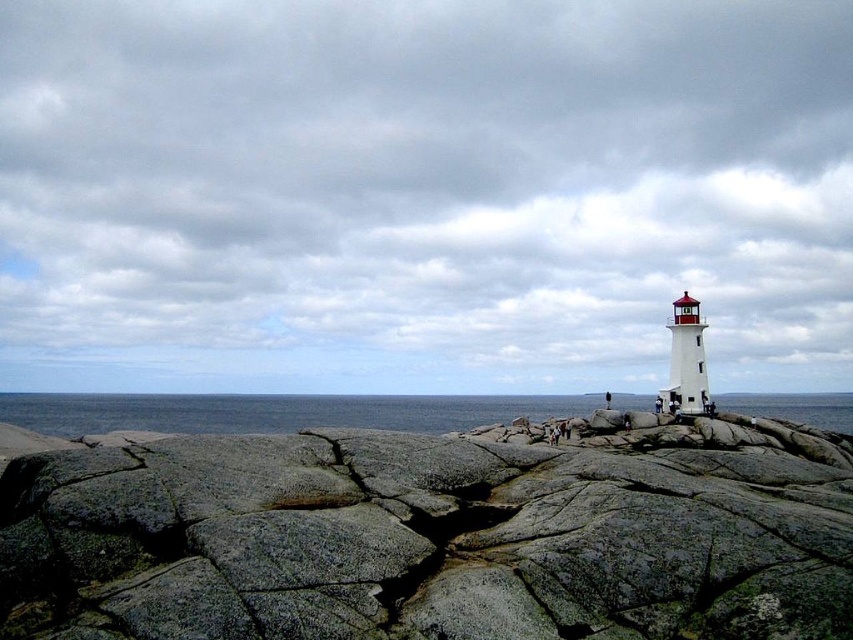
Question: Which object appears closest to the camera in this image?

Choices:
 (A) white painted lighthouse at right
 (B) gray rock at center
 (C) blue water at center

Answer: (B)

Question: Among these objects, which one is farthest from the camera?

Choices:
 (A) blue water at center
 (B) gray rock at center
 (C) white painted lighthouse at right

Answer: (C)

Question: Among these objects, which one is farthest from the camera?

Choices:
 (A) white painted lighthouse at right
 (B) blue water at center

Answer: (A)

Question: Can you confirm if gray rock at center is positioned above blue water at center?

Choices:
 (A) no
 (B) yes

Answer: (B)

Question: Does white painted lighthouse at right appear on the right side of gray rock at center?

Choices:
 (A) yes
 (B) no

Answer: (B)

Question: Is the position of white painted lighthouse at right less distant than that of blue water at center?

Choices:
 (A) yes
 (B) no

Answer: (B)